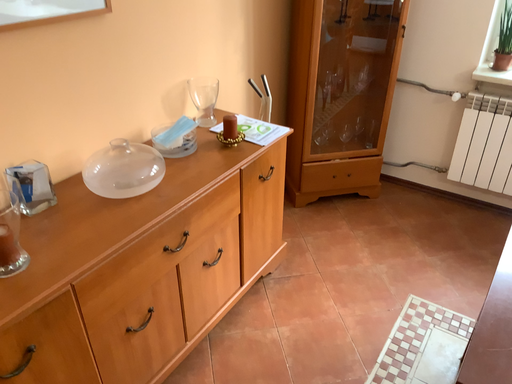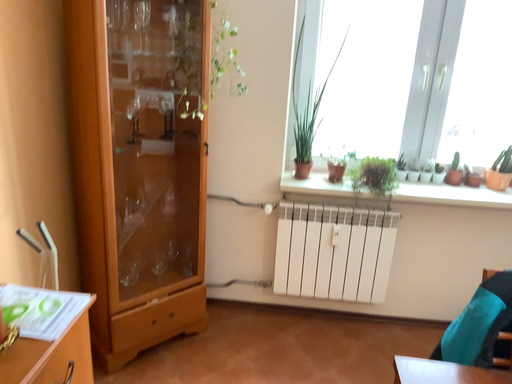
Question: How did the camera likely rotate when shooting the video?

Choices:
 (A) rotated right
 (B) rotated left

Answer: (A)